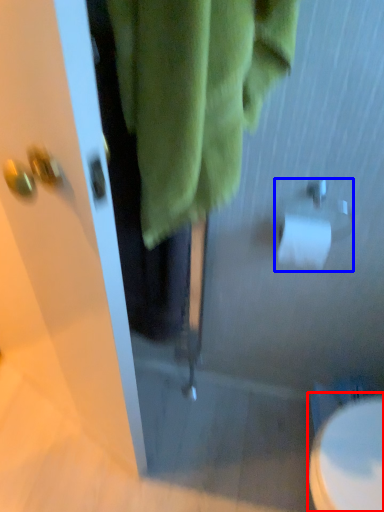
Question: Which of the following is the farthest to the observer, toilet (highlighted by a red box) or toilet paper (highlighted by a blue box)?

Choices:
 (A) toilet
 (B) toilet paper

Answer: (A)